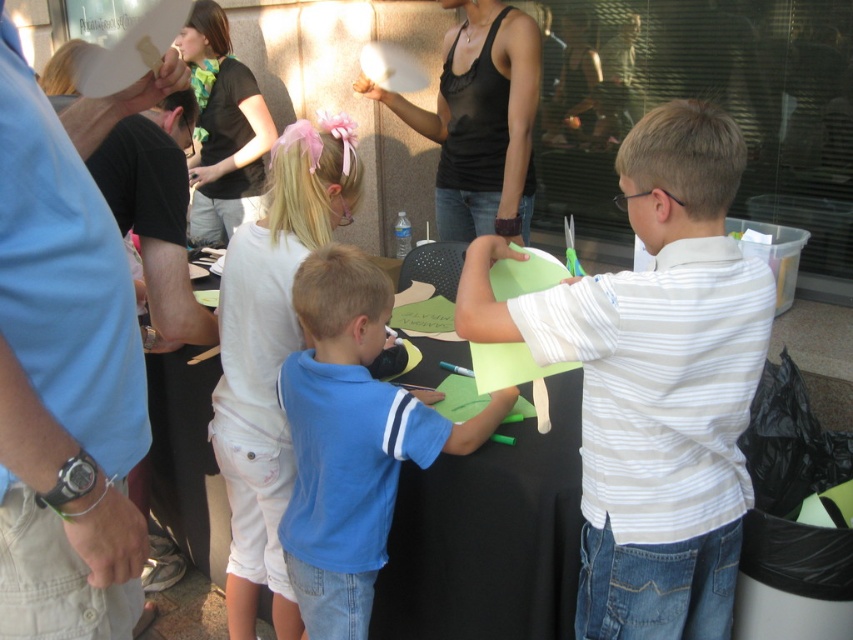
Question: Is blue shirt at upper left above blue cotton shirt at center?

Choices:
 (A) yes
 (B) no

Answer: (A)

Question: Based on their relative distances, which object is nearer to the blue cotton shirt at center?

Choices:
 (A) white striped shirt at center
 (B) black tank top at upper center

Answer: (A)

Question: Among these objects, which one is farthest from the camera?

Choices:
 (A) blue cotton shirt at center
 (B) black tank top at upper center
 (C) blue shirt at upper left
 (D) white striped shirt at center

Answer: (B)

Question: Which point appears closest to the camera in this image?

Choices:
 (A) (664, 378)
 (B) (10, 157)
 (C) (477, 83)
 (D) (380, 291)

Answer: (B)

Question: Does white striped shirt at center have a lesser width compared to blue cotton shirt at center?

Choices:
 (A) no
 (B) yes

Answer: (A)

Question: Where is white striped shirt at center located in relation to black tank top at upper center in the image?

Choices:
 (A) left
 (B) right

Answer: (B)